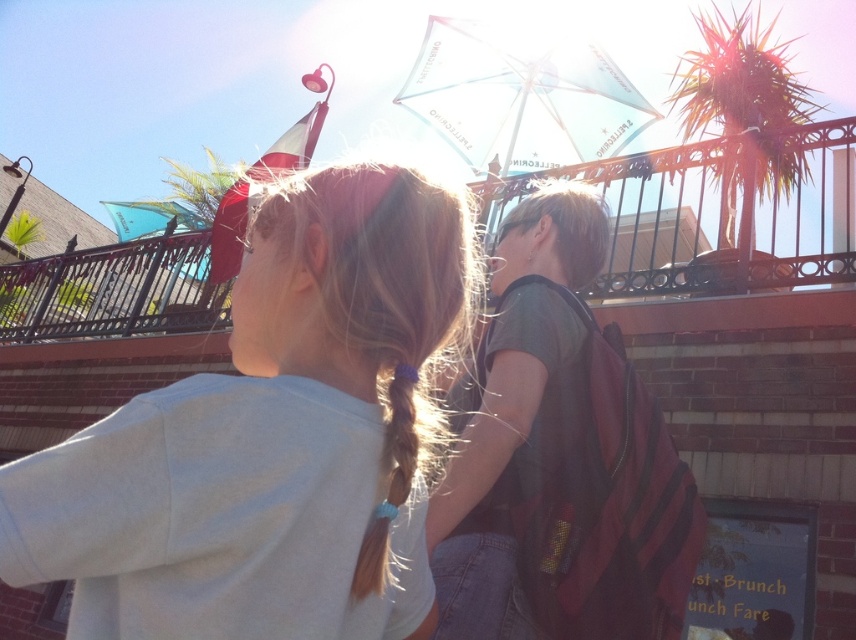
You are a photographer trying to capture a candid shot of the two people walking along the brick pathway. You notice the dark gray backpack at center and the brown silky hair at center in your viewfinder. Which object should you focus on if you want to capture the taller object in the scene?

The dark gray backpack at center is much taller than the brown silky hair at center, so you should focus on the dark gray backpack at center to capture the taller object in the scene.

You are standing at the starting point and see two points in the scene. The first point is labeled as point (102, 561) and the second is point (670, 573). Which point is closer to you?

Point (102, 561) is closer to you because it is in front of point (670, 573).